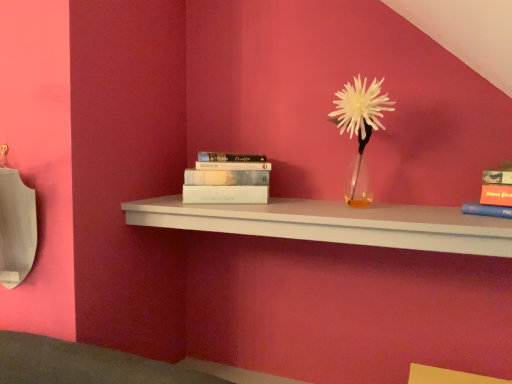
Question: Is white matte book at center, which ranks as the 2th book in right-to-left order, facing away from white matte flower at center?

Choices:
 (A) no
 (B) yes

Answer: (A)

Question: Can you confirm if white matte book at center, which ranks as the 1th book in back-to-front order, is taller than white matte flower at center?

Choices:
 (A) yes
 (B) no

Answer: (B)

Question: Is white matte book at center, which ranks as the 2th book in right-to-left order, smaller than white matte flower at center?

Choices:
 (A) no
 (B) yes

Answer: (B)

Question: Can we say white matte book at center, which is the 1th book from left to right, lies outside white matte flower at center?

Choices:
 (A) no
 (B) yes

Answer: (B)

Question: Is white matte book at center, which is the 1th book from left to right, at the left side of white matte flower at center?

Choices:
 (A) yes
 (B) no

Answer: (A)

Question: Is white matte book at center, which ranks as the 1th book in back-to-front order, at the right side of white matte flower at center?

Choices:
 (A) yes
 (B) no

Answer: (B)

Question: Can you see white matte flower at center touching white matte book at center, which is the 1th book from left to right?

Choices:
 (A) no
 (B) yes

Answer: (A)

Question: Is there a large distance between white matte flower at center and white matte book at center, which is the 1th book from left to right?

Choices:
 (A) yes
 (B) no

Answer: (B)

Question: Is white matte flower at center surrounding white matte book at center, which ranks as the 1th book in back-to-front order?

Choices:
 (A) yes
 (B) no

Answer: (B)

Question: Is white matte flower at center at the right side of white matte book at center, which ranks as the 1th book in back-to-front order?

Choices:
 (A) no
 (B) yes

Answer: (B)

Question: Considering the relative sizes of white matte flower at center and white matte book at center, which is the 2th book in front-to-back order, in the image provided, is white matte flower at center smaller than white matte book at center, which is the 2th book in front-to-back order,?

Choices:
 (A) yes
 (B) no

Answer: (B)

Question: From a real-world perspective, is white matte flower at center physically below white matte book at center, which is the 2th book in front-to-back order?

Choices:
 (A) no
 (B) yes

Answer: (A)

Question: Is white matte book at center, which is the 1th book from left to right, positioned behind white matte shelf at center?

Choices:
 (A) yes
 (B) no

Answer: (A)